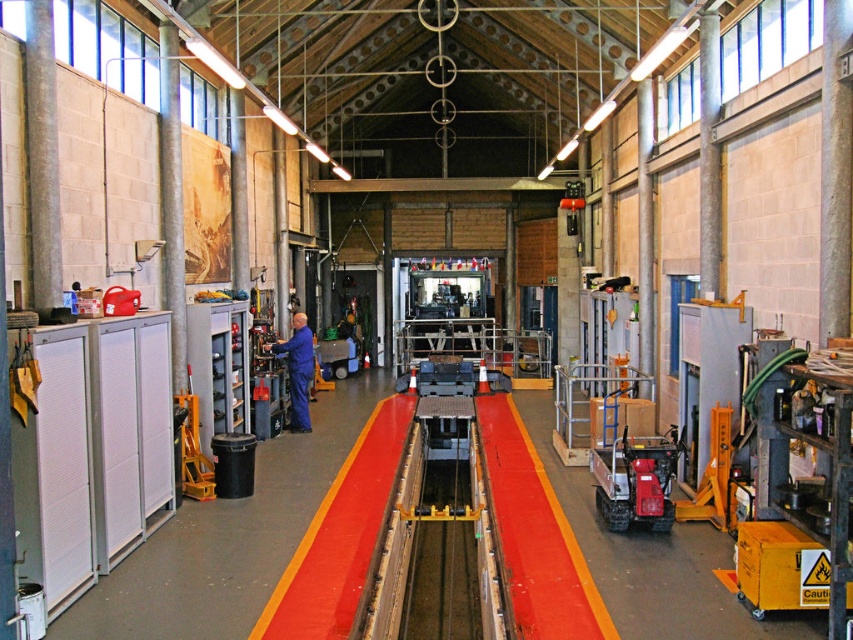
Question: Which of the following is the closest to the observer?

Choices:
 (A) (664, 460)
 (B) (297, 388)

Answer: (A)

Question: Is red plastic forklift at center further to camera compared to blue uniform at center?

Choices:
 (A) yes
 (B) no

Answer: (B)

Question: Which point appears farthest from the camera in this image?

Choices:
 (A) (596, 492)
 (B) (305, 406)

Answer: (B)

Question: Observing the image, what is the correct spatial positioning of red plastic forklift at center in reference to blue uniform at center?

Choices:
 (A) left
 (B) right

Answer: (B)

Question: Can you confirm if red plastic forklift at center is thinner than blue uniform at center?

Choices:
 (A) no
 (B) yes

Answer: (A)